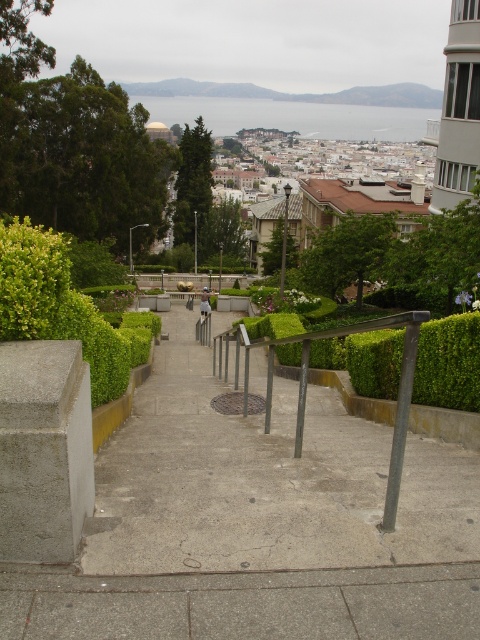
Question: Among these points, which one is farthest from the camera?

Choices:
 (A) (99, 577)
 (B) (201, 300)

Answer: (B)

Question: From the image, what is the correct spatial relationship of gray concrete pavement at center in relation to metallic gray railing at center?

Choices:
 (A) below
 (B) above

Answer: (A)

Question: Among these points, which one is farthest from the camera?

Choices:
 (A) (208, 301)
 (B) (296, 442)
 (C) (230, 621)

Answer: (A)

Question: Which of the following is the closest to the observer?

Choices:
 (A) metallic gray railing at center
 (B) gray concrete pavement at center

Answer: (B)

Question: Where is metallic gray railing at center located in relation to light brown wooden bench at center in the image?

Choices:
 (A) right
 (B) left

Answer: (A)

Question: Can you confirm if metallic gray railing at center is positioned to the right of light brown wooden bench at center?

Choices:
 (A) no
 (B) yes

Answer: (B)